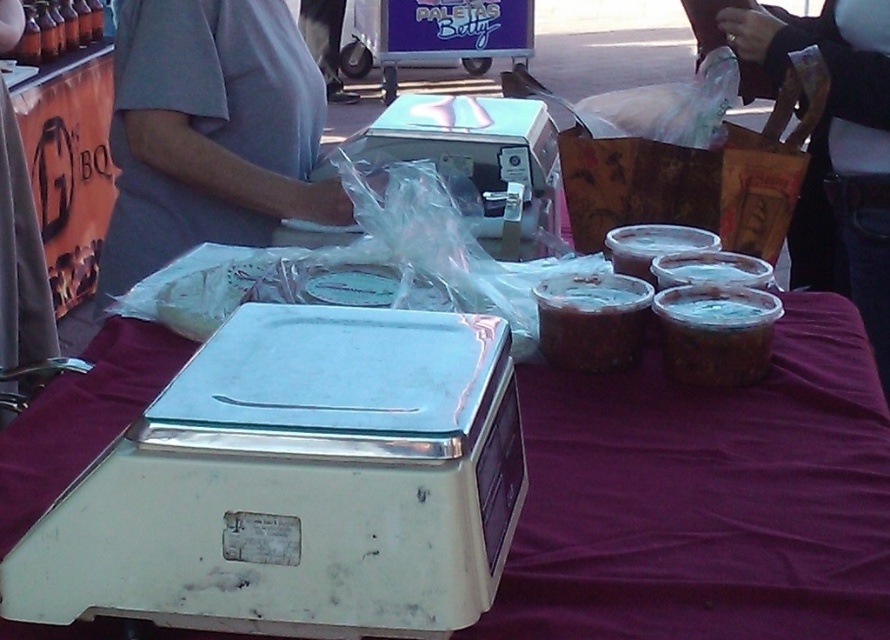
The width and height of the screenshot is (890, 640). What are the coordinates of `purple fabric at center` in the screenshot? It's located at (705, 499).

In order to click on purple fabric at center in this screenshot , I will do `click(705, 499)`.

Does purple fabric at center have a greater height compared to brown matte plastic container at right?

Indeed, purple fabric at center has a greater height compared to brown matte plastic container at right.

Who is taller, purple fabric at center or brown matte plastic container at right?

Standing taller between the two is purple fabric at center.

Where is `purple fabric at center`? This screenshot has width=890, height=640. purple fabric at center is located at coordinates (705, 499).

Between brown matte plastic container at right and brown matte jar at center, which one appears on the left side from the viewer's perspective?

Positioned to the left is brown matte jar at center.

Does brown matte plastic container at right have a smaller size compared to brown matte jar at center?

Correct, brown matte plastic container at right occupies less space than brown matte jar at center.

Is point (709, 378) closer to camera compared to point (611, 339)?

Yes, it is.

The width and height of the screenshot is (890, 640). I want to click on brown matte plastic container at right, so click(x=715, y=332).